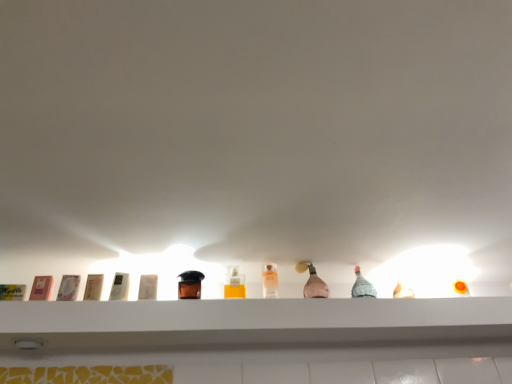
Question: Is matte brown lotion at left, placed as the 2th toiletry when sorted from left to right, further to the viewer compared to translucent glass bottle at center, the second bottle positioned from the left?

Choices:
 (A) yes
 (B) no

Answer: (B)

Question: Is matte brown lotion at left, which ranks as the 4th toiletry in right-to-left order, not within translucent glass bottle at center, the second bottle positioned from the left?

Choices:
 (A) yes
 (B) no

Answer: (A)

Question: From the image's perspective, is matte brown lotion at left, which ranks as the 4th toiletry in right-to-left order, under translucent glass bottle at center, the second bottle positioned from the left?

Choices:
 (A) no
 (B) yes

Answer: (A)

Question: Is matte brown lotion at left, which ranks as the 4th toiletry in right-to-left order, shorter than translucent glass bottle at center, the second bottle positioned from the left?

Choices:
 (A) no
 (B) yes

Answer: (B)

Question: From a real-world perspective, is matte brown lotion at left, placed as the 2th toiletry when sorted from left to right, below translucent glass bottle at center, which appears as the 1th bottle when viewed from the right?

Choices:
 (A) yes
 (B) no

Answer: (A)

Question: From the image's perspective, is matte brown lotion at left, placed as the 2th toiletry when sorted from left to right, on top of translucent glass bottle at center, which appears as the 1th bottle when viewed from the right?

Choices:
 (A) yes
 (B) no

Answer: (A)

Question: Does translucent glass bottle at center, the second bottle positioned from the left, have a lesser height compared to clear glass bottle at center, positioned as the second bottle in right-to-left order?

Choices:
 (A) no
 (B) yes

Answer: (A)

Question: Is translucent glass bottle at center, which appears as the 1th bottle when viewed from the right, at the right side of clear glass bottle at center, placed as the first bottle when sorted from left to right?

Choices:
 (A) yes
 (B) no

Answer: (A)

Question: Is translucent glass bottle at center, which appears as the 1th bottle when viewed from the right, smaller than clear glass bottle at center, placed as the first bottle when sorted from left to right?

Choices:
 (A) yes
 (B) no

Answer: (B)

Question: Considering the relative sizes of translucent glass bottle at center, the second bottle positioned from the left, and clear glass bottle at center, positioned as the second bottle in right-to-left order, in the image provided, is translucent glass bottle at center, the second bottle positioned from the left, bigger than clear glass bottle at center, positioned as the second bottle in right-to-left order,?

Choices:
 (A) yes
 (B) no

Answer: (A)

Question: From a real-world perspective, is translucent glass bottle at center, the second bottle positioned from the left, positioned over clear glass bottle at center, positioned as the second bottle in right-to-left order, based on gravity?

Choices:
 (A) no
 (B) yes

Answer: (B)

Question: Is the position of translucent glass bottle at center, the second bottle positioned from the left, less distant than that of clear glass bottle at center, positioned as the second bottle in right-to-left order?

Choices:
 (A) yes
 (B) no

Answer: (B)

Question: Is white plastic container at center, which is the second toiletry in right-to-left order, outside of pink glass bottle at center?

Choices:
 (A) yes
 (B) no

Answer: (A)